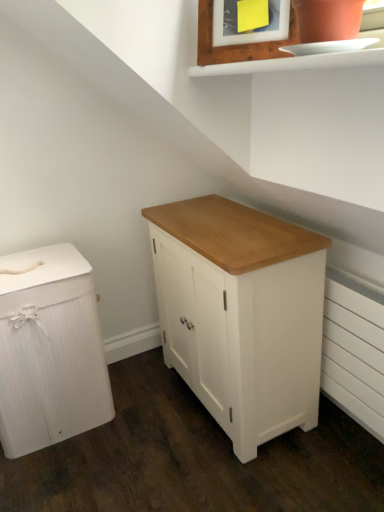
The width and height of the screenshot is (384, 512). In order to click on empty space that is to the right of white wood chest of drawers at left, the second chest of drawers positioned from the right in this screenshot , I will do `click(142, 436)`.